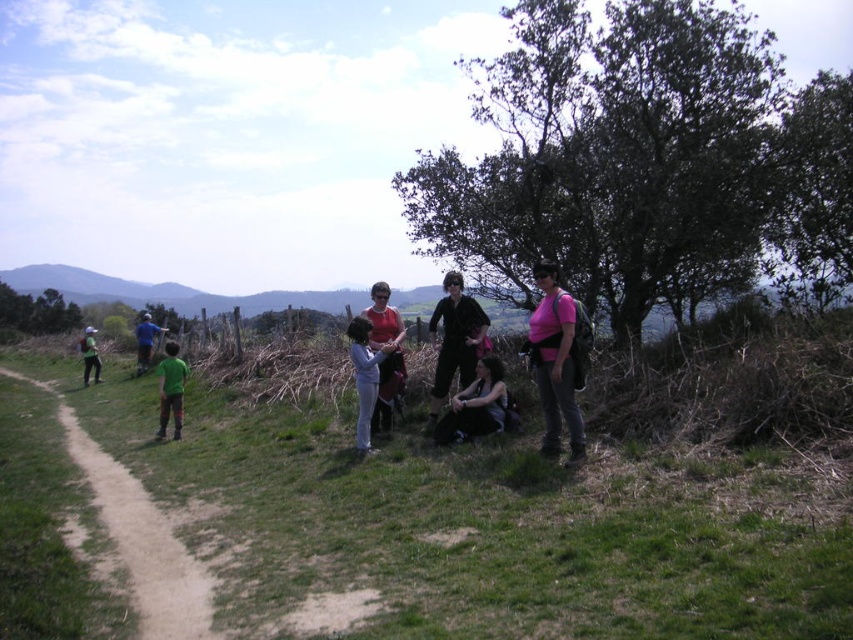
You are a photographer trying to capture a clear photo of the green fabric jacket at left without the green matte shirt at lower left blocking it. What should you do?

Move your camera angle to the side so that the green matte shirt at lower left is no longer in front of the green fabric jacket at left.

You are standing at point (141, 368) and want to walk to point (541, 328). Is the destination point in front of you?

Yes, the destination point (541, 328) is in front of point (141, 368), so it is in front of you.

You are a hiker who wants to place a light blue fabric at center on top of the blue fabric shirt at left. Is this possible based on their positions?

The light blue fabric at center is below the blue fabric shirt at left, so placing it on top would require moving the blue fabric shirt at left first.